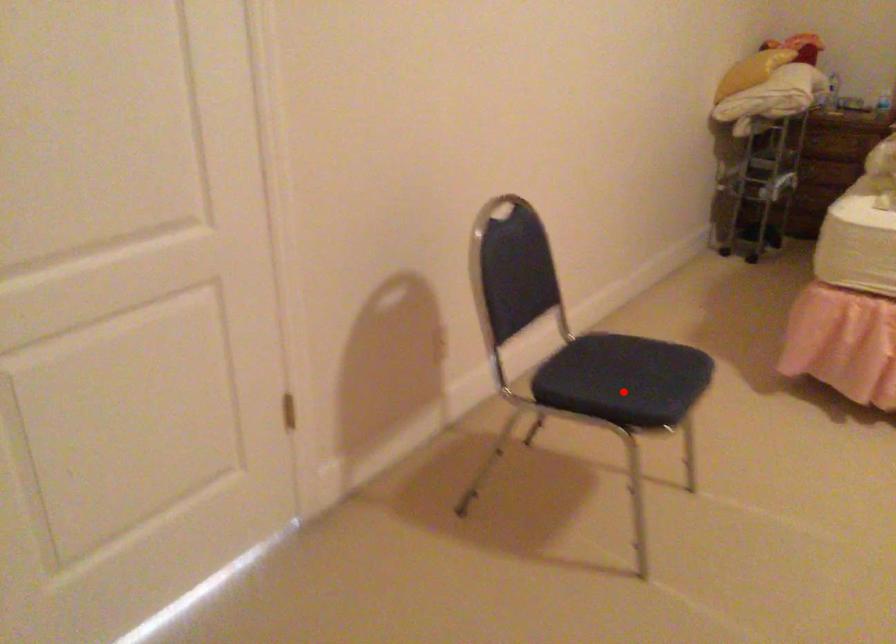
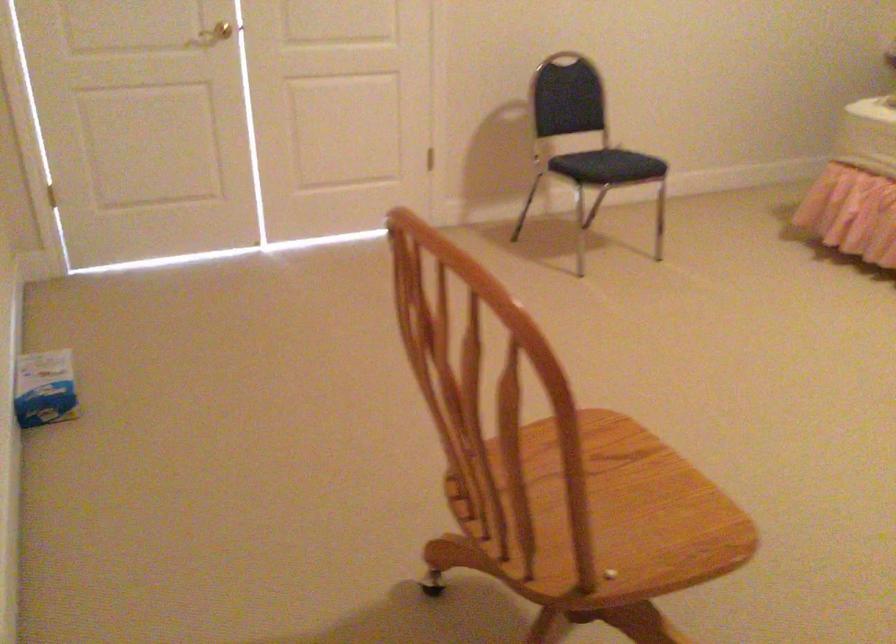
Question: I am providing you with two images of the same scene from different viewpoints. A red point is marked on the first image. At the location where the point appears in image 1, is it still visible in image 2?

Choices:
 (A) Yes
 (B) No

Answer: (A)